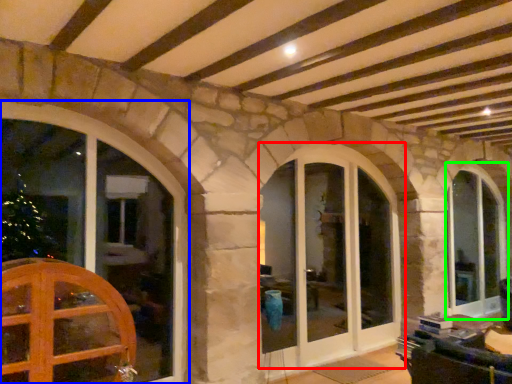
Question: Which object is the closest to the window (highlighted by a red box)? Choose among these: window (highlighted by a blue box) or window (highlighted by a green box).

Choices:
 (A) window
 (B) window

Answer: (B)